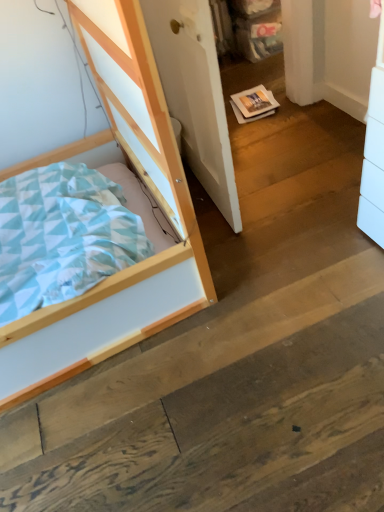
This screenshot has width=384, height=512. In order to click on unoccupied region to the right of light wood bed at left in this screenshot , I will do `click(284, 229)`.